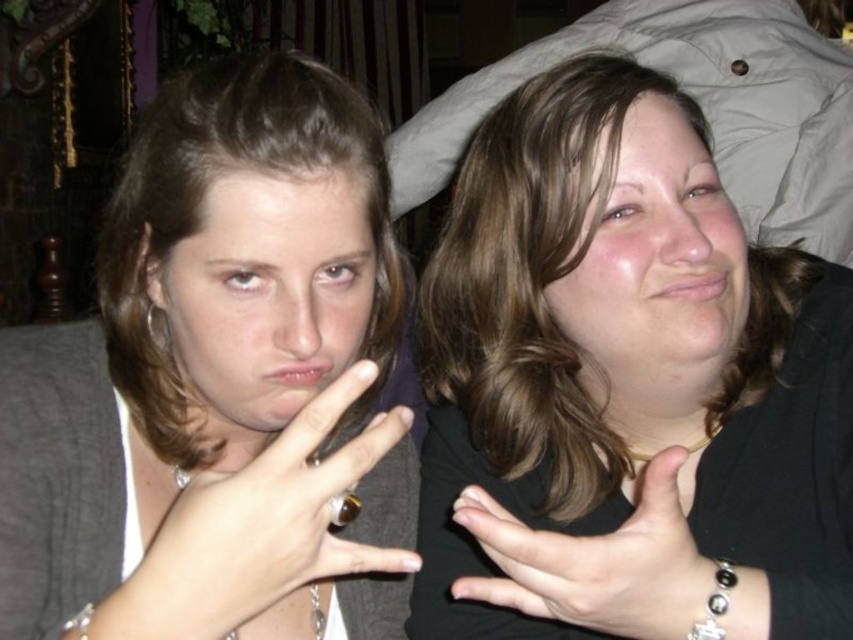
You are a photographer who needs to capture a closeup shot of the gold ring at center and the silver metallic earring at upper left. Which object should you focus on first if you want to ensure both are in focus without moving the camera?

The gold ring at center should be focused on first because it is closer to the camera than the silver metallic earring at upper left, so focusing on it will ensure both are in focus using the depth of field.

Please describe the location of the matte black ring at center in terms of coordinates within the image. The image has a coordinate system where the bottom left corner is the origin point. The x and y axes increase to the right and upward respectively. The coordinates are normalized between 0 and 1. The two people in the image are seated next to each other. The person on the left is wearing a dark gray cardigan, and the person on the right is wearing a black top. The ring is located on the right hand of the

The matte black ring at center is located at coordinates point (218, 385). This means it is positioned 60.2 percent of the image width from the left edge and 25.7 percent of the image height from the bottom edge. Since the coordinate system starts at the bottom left corner, the ring is closer to the center right area of the image.

You are standing in front of the two people in the image and want to place a small gift exactly halfway between the two points marked as point (x=347, y=484) and point (x=155, y=320). Considering their positions, will the gift be closer to the person on the left or the right?

The gift placed halfway between point (x=347, y=484) and point (x=155, y=320) will be closer to the person on the right because point (x=347, y=484) is closer to the viewer than point (x=155, y=320), meaning the midpoint leans towards the right person.